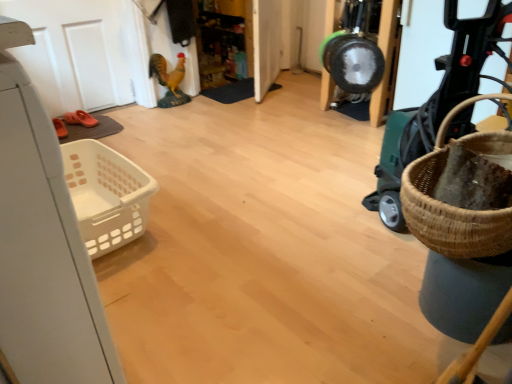
Question: Does green plastic baby carriage at right appear on the left side of shiny plastic rooster at upper center?

Choices:
 (A) yes
 (B) no

Answer: (B)

Question: From the image's perspective, does green plastic baby carriage at right appear higher than shiny plastic rooster at upper center?

Choices:
 (A) yes
 (B) no

Answer: (B)

Question: Is green plastic baby carriage at right located outside shiny plastic rooster at upper center?

Choices:
 (A) yes
 (B) no

Answer: (A)

Question: Considering the relative sizes of green plastic baby carriage at right and shiny plastic rooster at upper center in the image provided, is green plastic baby carriage at right taller than shiny plastic rooster at upper center?

Choices:
 (A) no
 (B) yes

Answer: (B)

Question: Is shiny plastic rooster at upper center at the back of green plastic baby carriage at right?

Choices:
 (A) no
 (B) yes

Answer: (A)

Question: Are green plastic baby carriage at right and shiny plastic rooster at upper center far apart?

Choices:
 (A) yes
 (B) no

Answer: (A)

Question: Is green plastic baby carriage at right facing towards orange rubber sandal at left?

Choices:
 (A) no
 (B) yes

Answer: (A)

Question: Does green plastic baby carriage at right appear on the right side of orange rubber sandal at left?

Choices:
 (A) no
 (B) yes

Answer: (B)

Question: From a real-world perspective, is green plastic baby carriage at right over orange rubber sandal at left?

Choices:
 (A) no
 (B) yes

Answer: (B)

Question: From the image's perspective, is green plastic baby carriage at right on top of orange rubber sandal at left?

Choices:
 (A) yes
 (B) no

Answer: (B)

Question: Can you confirm if green plastic baby carriage at right is wider than orange rubber sandal at left?

Choices:
 (A) no
 (B) yes

Answer: (B)

Question: Does green plastic baby carriage at right contain orange rubber sandal at left?

Choices:
 (A) yes
 (B) no

Answer: (B)

Question: Would you say white matte door at upper left, which ranks as the 1th door in left-to-right order, is part of shiny plastic rooster at upper center's contents?

Choices:
 (A) no
 (B) yes

Answer: (A)